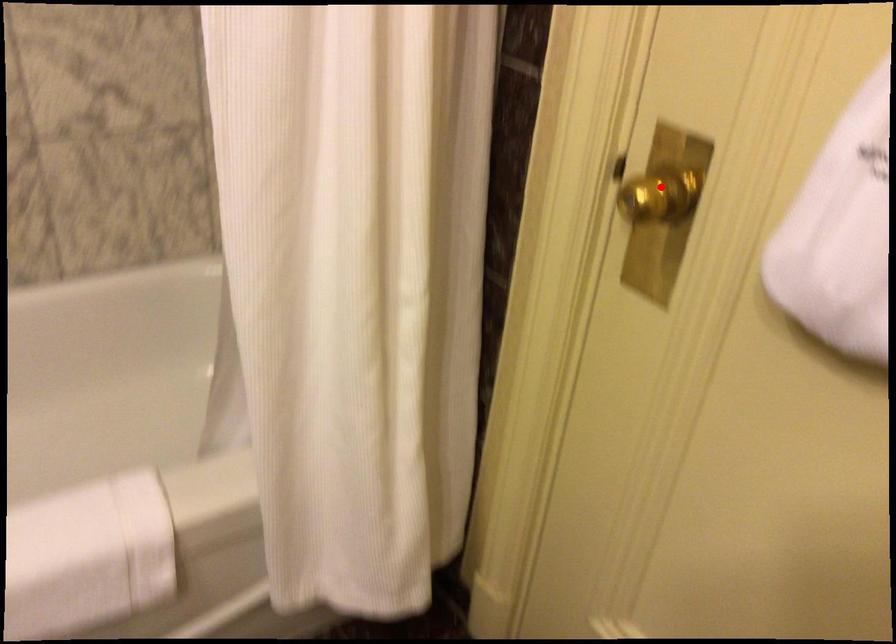
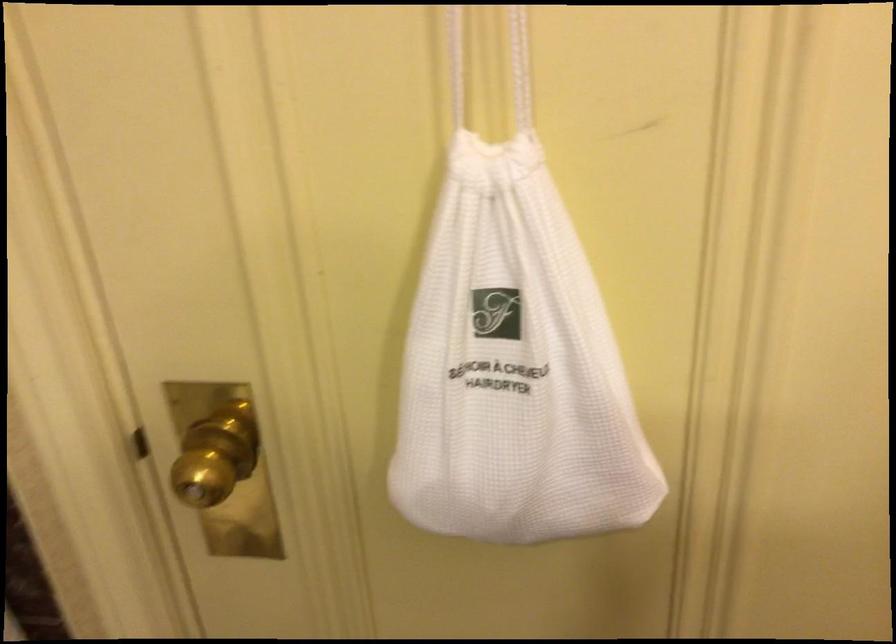
Question: A red point is marked in image1. In image2, is the corresponding 3D point closer to the camera or farther? Reply with the corresponding letter.

Choices:
 (A) The corresponding 3D point is closer.
 (B) The corresponding 3D point is farther.

Answer: (A)